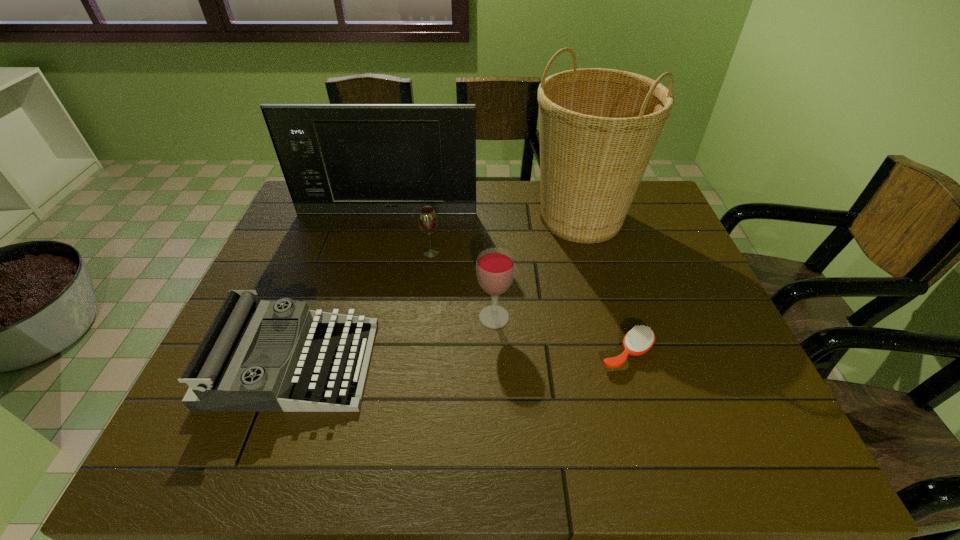
This screenshot has width=960, height=540. What are the coordinates of `free point between the basket and the right wineglass` in the screenshot? It's located at (538, 267).

Image resolution: width=960 pixels, height=540 pixels. What are the coordinates of `empty space that is in between the basket and the typewriter` in the screenshot? It's located at (437, 291).

At what (x,y) coordinates should I click in order to perform the action: click on free point between the hairbrush and the typewriter. Please return your answer as a coordinate pair (x, y). Looking at the image, I should click on (460, 358).

Where is `vacant region between the second tallest object and the left wineglass`? vacant region between the second tallest object and the left wineglass is located at coordinates (409, 233).

Find the location of a particular element. The image size is (960, 540). the second closest object to the right wineglass is located at coordinates (427, 218).

Locate an element on the screen. The width and height of the screenshot is (960, 540). object that is the nearest to the microwave oven is located at coordinates (427, 218).

At what (x,y) coordinates should I click in order to perform the action: click on vacant area that satisfies the following two spatial constraints: 1. on the front panel of the fifth shortest object; 2. on the typing side of the typewriter. Please return your answer as a coordinate pair (x, y). The height and width of the screenshot is (540, 960). Looking at the image, I should click on (348, 363).

This screenshot has height=540, width=960. In order to click on vacant area in the image that satisfies the following two spatial constraints: 1. on the back side of the basket; 2. on the left side of the left wineglass in this screenshot , I will do `click(435, 218)`.

The image size is (960, 540). In order to click on vacant point that satisfies the following two spatial constraints: 1. on the front panel of the shortest object; 2. on the right side of the fifth shortest object in this screenshot , I will do coord(351,352).

The image size is (960, 540). I want to click on blank area in the image that satisfies the following two spatial constraints: 1. on the front panel of the microwave oven; 2. on the right side of the left wineglass, so click(x=377, y=252).